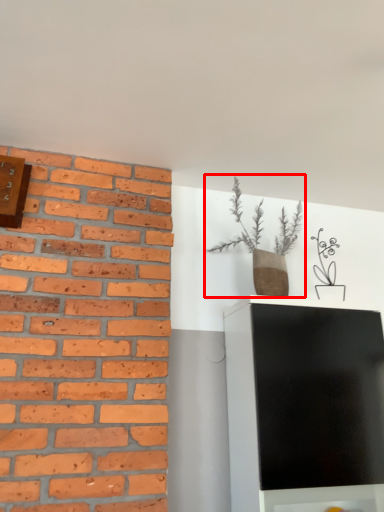
Question: Observing the image, what is the correct spatial positioning of houseplant (annotated by the red box) in reference to clock?

Choices:
 (A) right
 (B) left

Answer: (A)